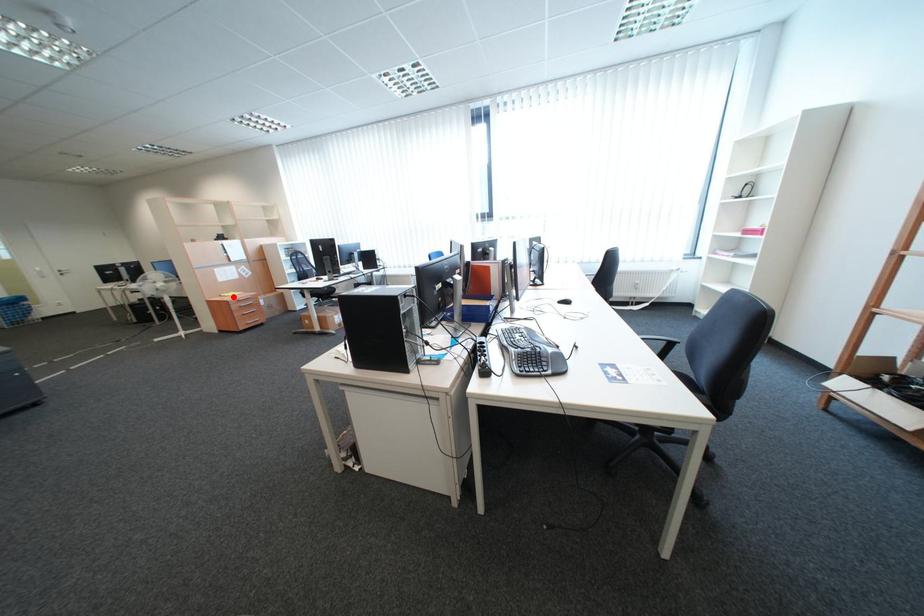
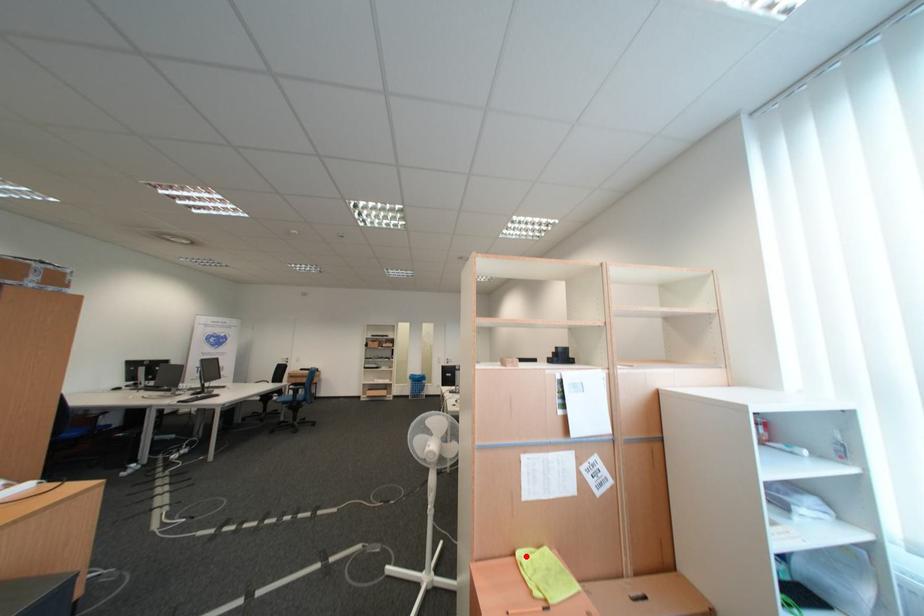
I am providing you with two images of the same scene from different viewpoints. A red point is marked on the first image and another point is marked on the second image. Does the point marked in image1 correspond to the same location as the one in image2?

Yes